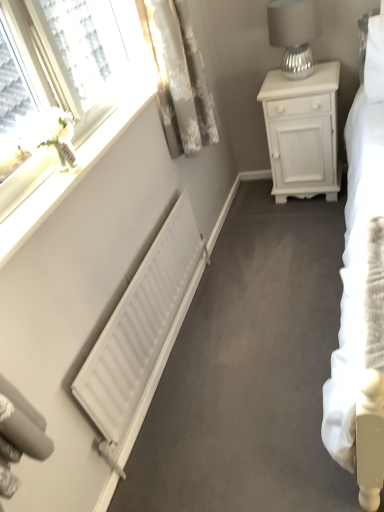
The image size is (384, 512). Find the location of `vacant space in white matte radiator at lower left (from a real-world perspective)`. vacant space in white matte radiator at lower left (from a real-world perspective) is located at coordinates (175, 351).